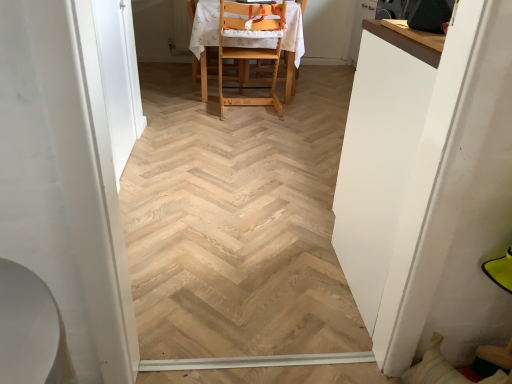
Find the location of a particular element. Image resolution: width=512 pixels, height=384 pixels. free space that is in between white glossy table at right and white glossy screen door at left, arranged as the first screen door when viewed from the front is located at coordinates (243, 264).